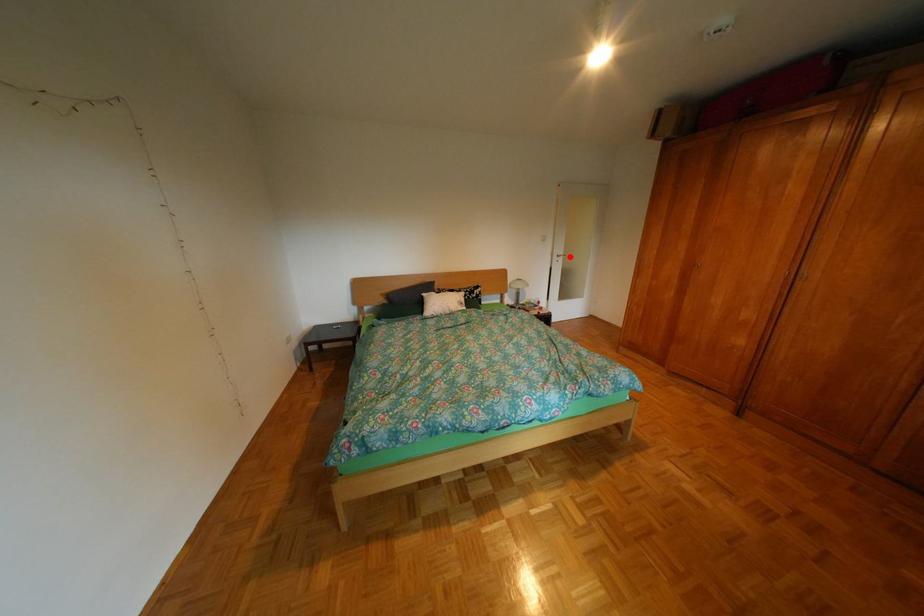
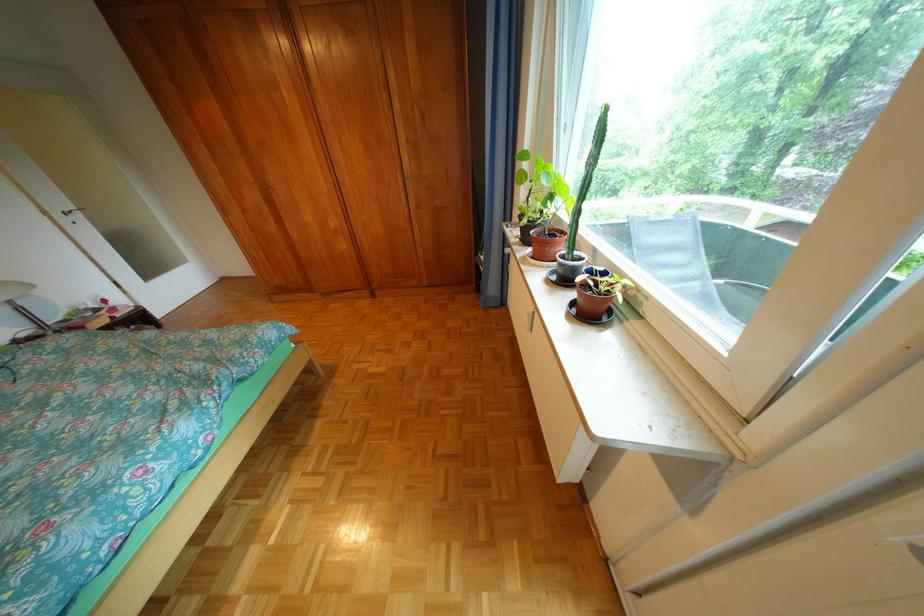
Question: I am providing you with two images of the same scene from different viewpoints. Given a red point in image1, look at the same physical point in image2. Is it:

Choices:
 (A) Closer to the viewpoint
 (B) Farther from the viewpoint

Answer: (B)